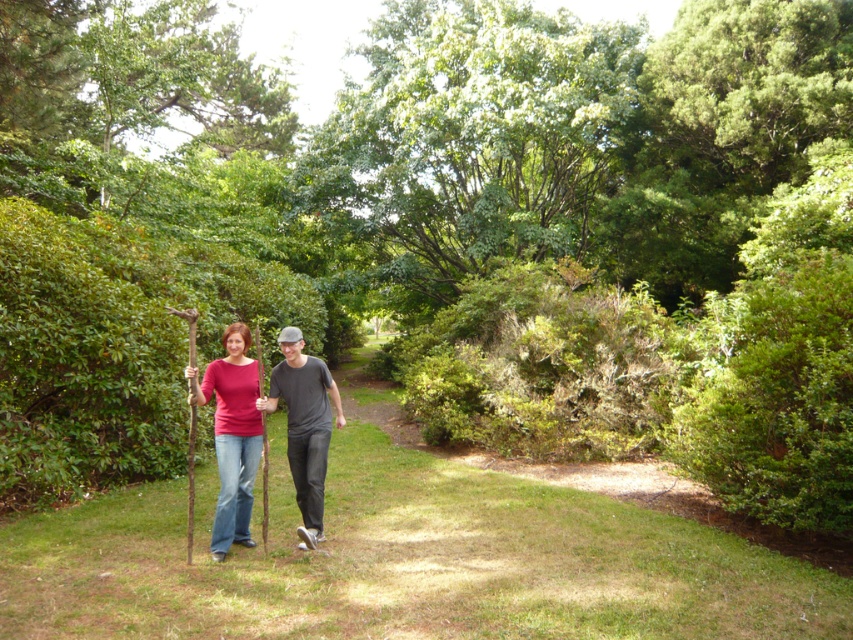
Question: Is green leafy hedge at center above matte brown sticks at center?

Choices:
 (A) yes
 (B) no

Answer: (A)

Question: Which object appears closest to the camera in this image?

Choices:
 (A) green leafy hedge at center
 (B) green leafy bush at center
 (C) matte brown sticks at center

Answer: (C)

Question: Can you confirm if green leafy bush at center is bigger than matte brown sticks at center?

Choices:
 (A) no
 (B) yes

Answer: (B)

Question: Which of the following is the closest to the observer?

Choices:
 (A) (628, 333)
 (B) (229, 252)
 (C) (258, 388)

Answer: (C)

Question: Which of the following is the farthest from the observer?

Choices:
 (A) matte brown sticks at center
 (B) green leafy bush at center
 (C) green leafy hedge at center

Answer: (B)

Question: Can you confirm if green leafy bush at center is positioned below matte brown sticks at center?

Choices:
 (A) yes
 (B) no

Answer: (B)